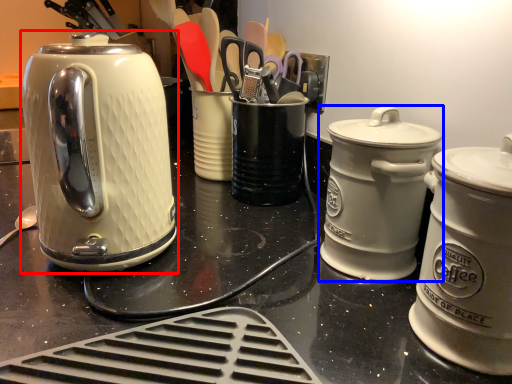
Question: Which object is further to the camera taking this photo, kettle (highlighted by a red box) or kitchen appliance (highlighted by a blue box)?

Choices:
 (A) kettle
 (B) kitchen appliance

Answer: (B)